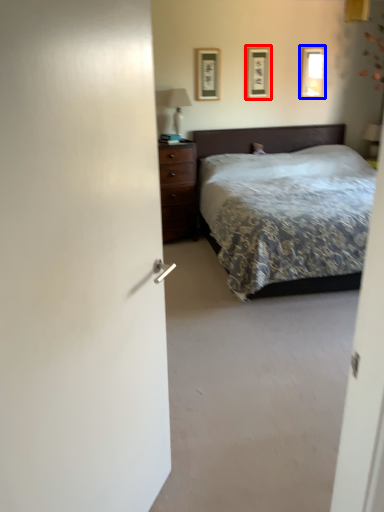
Question: Which object appears farthest to the camera in this image, picture frame (highlighted by a red box) or picture frame (highlighted by a blue box)?

Choices:
 (A) picture frame
 (B) picture frame

Answer: (B)